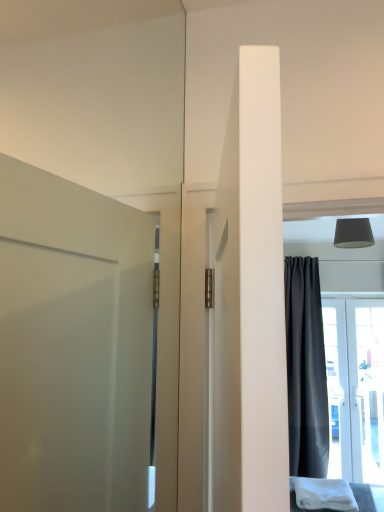
Question: Is white soft cloth at lower right outside of white glossy door at right?

Choices:
 (A) yes
 (B) no

Answer: (A)

Question: Considering the relative sizes of white soft cloth at lower right and white glossy door at right in the image provided, is white soft cloth at lower right wider than white glossy door at right?

Choices:
 (A) no
 (B) yes

Answer: (B)

Question: Does white soft cloth at lower right have a greater height compared to white glossy door at right?

Choices:
 (A) no
 (B) yes

Answer: (A)

Question: Is white soft cloth at lower right positioned with its back to white glossy door at right?

Choices:
 (A) no
 (B) yes

Answer: (A)

Question: From a real-world perspective, is white soft cloth at lower right over white glossy door at right?

Choices:
 (A) yes
 (B) no

Answer: (B)

Question: Could you tell me if white soft cloth at lower right is facing white glossy door at right?

Choices:
 (A) yes
 (B) no

Answer: (B)

Question: Does dark gray matte curtain at right appear on the left side of matte gray lampshade at upper right?

Choices:
 (A) yes
 (B) no

Answer: (B)

Question: Could you tell me if dark gray matte curtain at right is facing matte gray lampshade at upper right?

Choices:
 (A) yes
 (B) no

Answer: (A)

Question: From the image's perspective, is dark gray matte curtain at right located above matte gray lampshade at upper right?

Choices:
 (A) no
 (B) yes

Answer: (A)

Question: Is the depth of dark gray matte curtain at right greater than that of matte gray lampshade at upper right?

Choices:
 (A) no
 (B) yes

Answer: (B)

Question: Is dark gray matte curtain at right oriented away from matte gray lampshade at upper right?

Choices:
 (A) yes
 (B) no

Answer: (B)

Question: Would you say dark gray matte curtain at right contains matte gray lampshade at upper right?

Choices:
 (A) yes
 (B) no

Answer: (B)

Question: Is white soft cloth at lower right bigger than dark gray matte curtain at right?

Choices:
 (A) no
 (B) yes

Answer: (A)